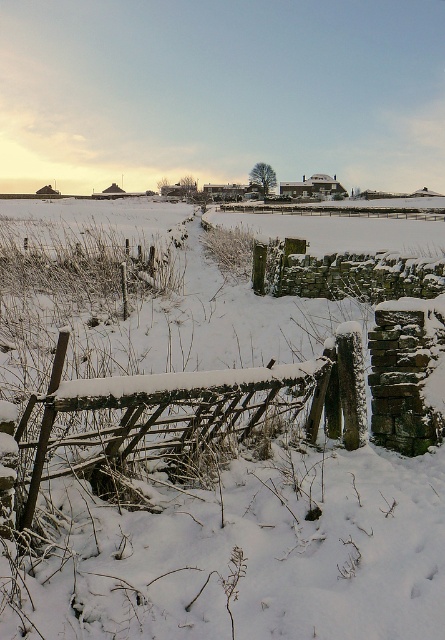
You are standing at the point marked as point (x=202, y=460) in the winter landscape image. What object is located exactly at your current position?

The white frosty fence at center is located exactly at point (x=202, y=460).

You are standing at the stone wall with the wooden gate in the winter scene. There are two points marked on the ground in front of you. The first point is at coordinate point (152, 552) and the second is at point (153, 412). If you want to walk towards the fields beyond the gate, which point should you step on first to stay closer to the path leading forward?

You should step on point (152, 552) first because it is in front of point (153, 412), meaning it is closer to the direction you want to go towards the fields beyond the gate.